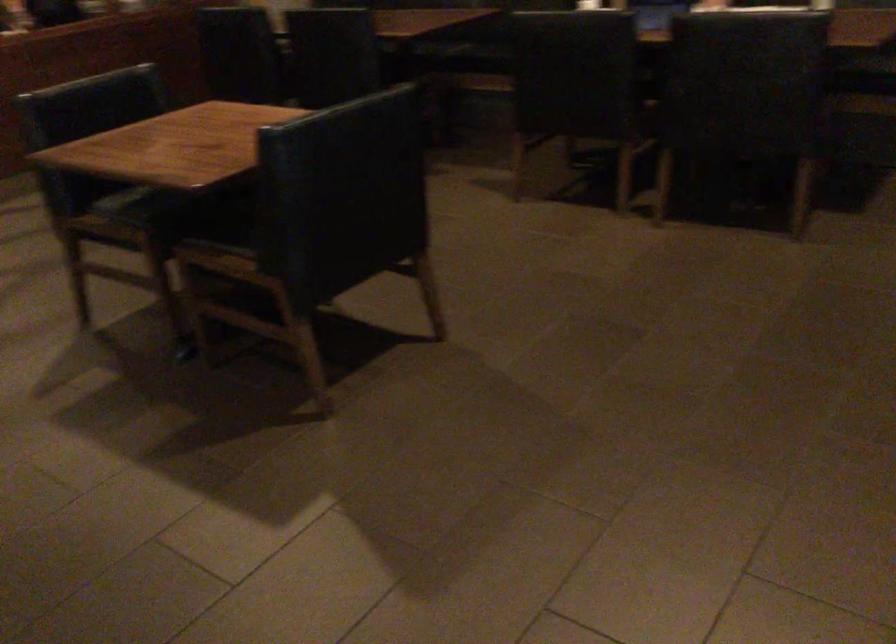
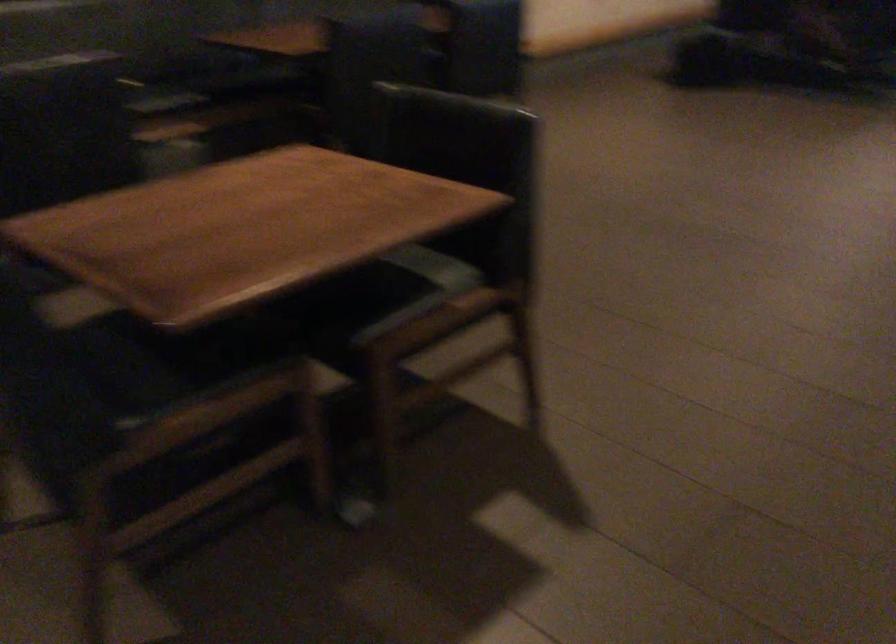
Question: How did the camera likely rotate?

Choices:
 (A) Left
 (B) Right
 (C) Up
 (D) Down

Answer: (B)